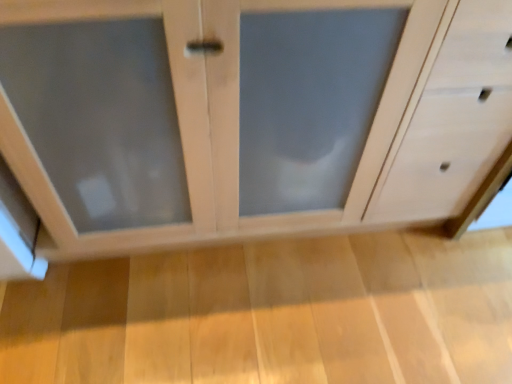
The height and width of the screenshot is (384, 512). In order to click on matte wood cabinet at center in this screenshot , I will do `click(248, 116)`.

The width and height of the screenshot is (512, 384). Describe the element at coordinates (248, 116) in the screenshot. I see `matte wood cabinet at center` at that location.

What is the approximate width of matte wood cabinet at center?

The width of matte wood cabinet at center is 23.47 inches.

This screenshot has width=512, height=384. Find the location of `matte wood cabinet at center`. matte wood cabinet at center is located at coordinates (248, 116).